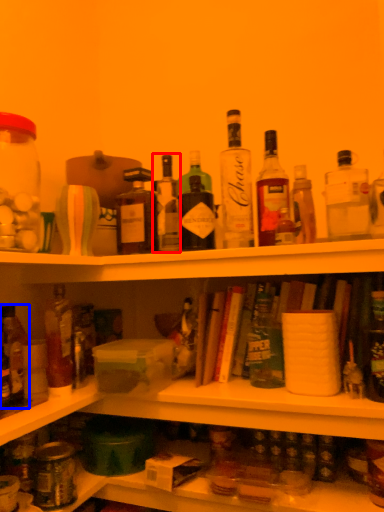
Question: Which object appears closest to the camera in this image, bottle (highlighted by a red box) or bottle (highlighted by a blue box)?

Choices:
 (A) bottle
 (B) bottle

Answer: (B)